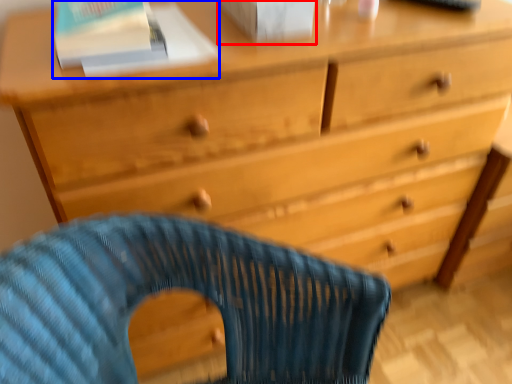
Question: Among these objects, which one is nearest to the camera, paperback book (highlighted by a red box) or paperback book (highlighted by a blue box)?

Choices:
 (A) paperback book
 (B) paperback book

Answer: (A)